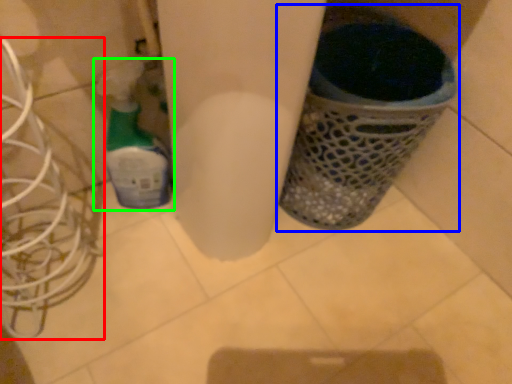
Question: Which is nearer to the wire (highlighted by a red box)? waste container (highlighted by a blue box) or bottle (highlighted by a green box).

Choices:
 (A) waste container
 (B) bottle

Answer: (B)